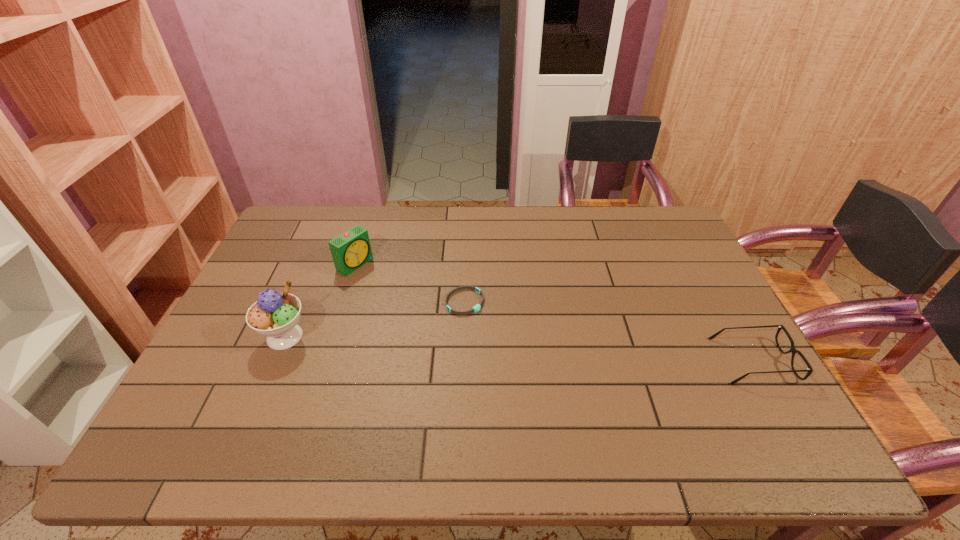
Locate an element on the screen. Image resolution: width=960 pixels, height=540 pixels. free space on the desktop that is between the icecream and the second shortest object and is positioned on the front-facing side of the third shortest object is located at coordinates (495, 348).

You are a GUI agent. You are given a task and a screenshot of the screen. Output one action in this format:
    pyautogui.click(x=<x>, y=<y>)
    Task: Click on the free space on the desktop that is between the leftmost object and the rightmost object and is positioned on the buckle of the wristband
    
    Given the screenshot: What is the action you would take?
    point(557,350)